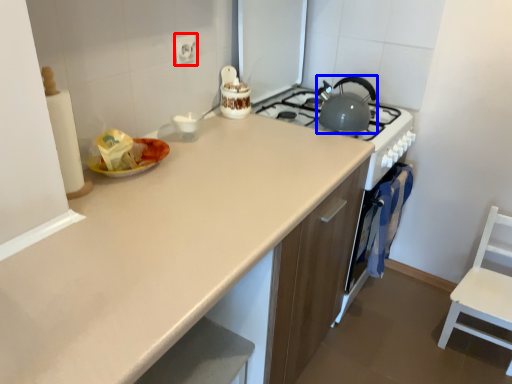
Question: Which point is further to the camera, electric outlet (highlighted by a red box) or kitchen appliance (highlighted by a blue box)?

Choices:
 (A) electric outlet
 (B) kitchen appliance

Answer: (B)